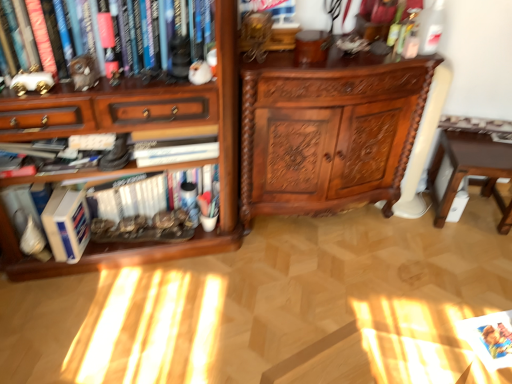
Question: Is wooden bookcase at left surrounding polished wood cabinet at center?

Choices:
 (A) no
 (B) yes

Answer: (A)

Question: Would you say wooden bookcase at left is a long distance from polished wood cabinet at center?

Choices:
 (A) yes
 (B) no

Answer: (B)

Question: Considering the relative positions of wooden bookcase at left and polished wood cabinet at center in the image provided, is wooden bookcase at left behind polished wood cabinet at center?

Choices:
 (A) yes
 (B) no

Answer: (B)

Question: Could you tell me if wooden bookcase at left is turned towards polished wood cabinet at center?

Choices:
 (A) yes
 (B) no

Answer: (B)

Question: Considering the relative positions of wooden bookcase at left and polished wood cabinet at center in the image provided, is wooden bookcase at left to the left of polished wood cabinet at center from the viewer's perspective?

Choices:
 (A) yes
 (B) no

Answer: (A)

Question: Can you confirm if wooden bookcase at left is wider than polished wood cabinet at center?

Choices:
 (A) yes
 (B) no

Answer: (A)

Question: Is matte white figurine at upper left, positioned as the second book in back-to-front order, with brown wooden table at lower right?

Choices:
 (A) no
 (B) yes

Answer: (A)

Question: From the image's perspective, is matte white figurine at upper left, the 1th book when ordered from top to bottom, located beneath brown wooden table at lower right?

Choices:
 (A) yes
 (B) no

Answer: (B)

Question: Is matte white figurine at upper left, placed as the second book when sorted from bottom to top, to the left of brown wooden table at lower right from the viewer's perspective?

Choices:
 (A) no
 (B) yes

Answer: (B)

Question: Can you confirm if matte white figurine at upper left, positioned as the second book in back-to-front order, is thinner than brown wooden table at lower right?

Choices:
 (A) yes
 (B) no

Answer: (A)

Question: Does matte white figurine at upper left, the 1th book when ordered from top to bottom, have a greater height compared to brown wooden table at lower right?

Choices:
 (A) no
 (B) yes

Answer: (A)

Question: Is matte white figurine at upper left, placed as the second book when sorted from bottom to top, oriented towards brown wooden table at lower right?

Choices:
 (A) no
 (B) yes

Answer: (A)

Question: Is wooden bookcase at left shorter than brown wooden table at lower right?

Choices:
 (A) no
 (B) yes

Answer: (A)